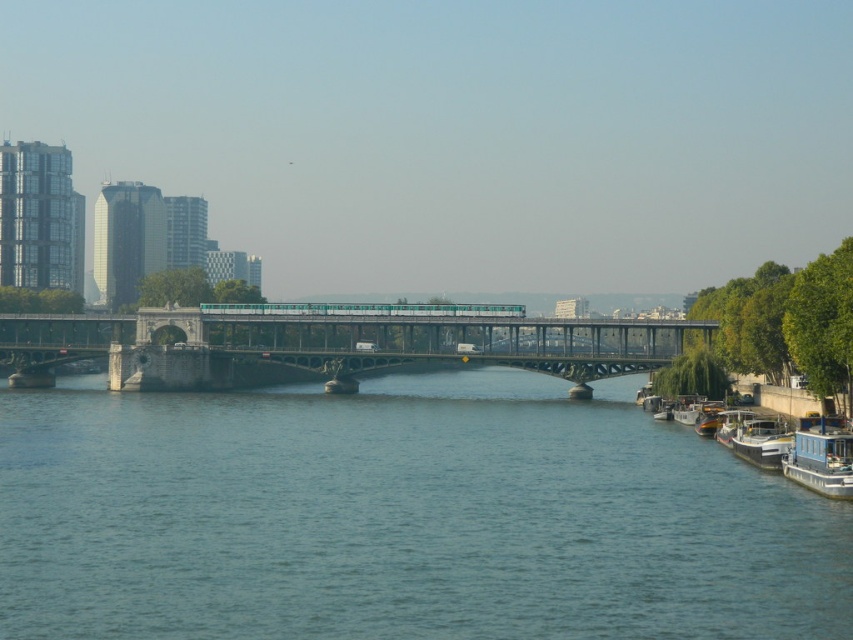
You are standing on the bridge and see two boats below. The blue painted wood boat at lower right and the white wooden boat at right. Which boat is closer to the bridge?

The blue painted wood boat at lower right is closer to the bridge because it is positioned above the white wooden boat at right.

From the picture: You are standing on the riverbank and want to take a photo of both the green metallic bridge at center and the metallic blue boat at lower right. Which object should you adjust your camera focus to first to ensure it appears sharp in the foreground?

You should focus on the green metallic bridge at center first because it is closer to you than the metallic blue boat at lower right, making it the foreground object.

You are a photographer planning to capture the entire bridge and its surroundings in a single shot. Given that your camera can only focus on objects within a 10m width, will the blue water at center and the white wooden boat at right both fit within the camera frame?

The blue water at center is wider than the white wooden boat at right. Since the camera can focus on objects within a 10m width, both objects can fit within the frame as their combined width may not exceed 10m. However, the exact arrangement depends on their individual widths and positioning in the scene.